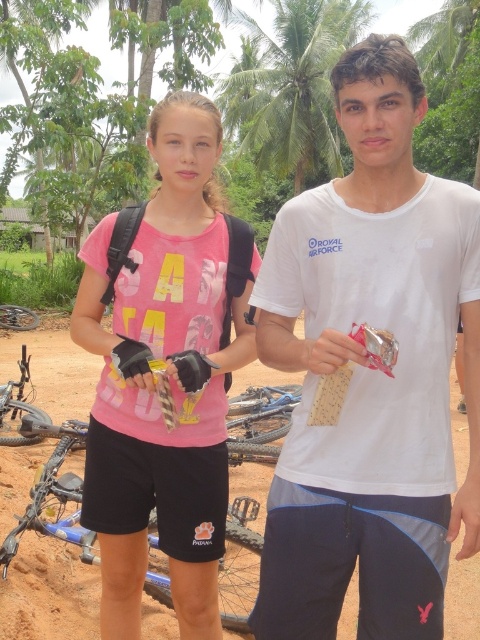
You are planning to drive a car that is 2 meters wide through the brown dirt track at center. Considering the green leafy palm tree at upper center is nearby, can the car pass through the track without hitting the tree?

The brown dirt track at center is narrower than the green leafy palm tree at upper center, so the car that is 2 meters wide may not fit through the track without risking collision with the tree.

Looking at this image, you are standing in a tropical setting with two points marked in the image. The first point is at coordinates point (458, 449) and the second point is at point (325, 108). Which of these two points is closer to you?

Point (458, 449) is closer to the viewer than point (325, 108) according to the description.